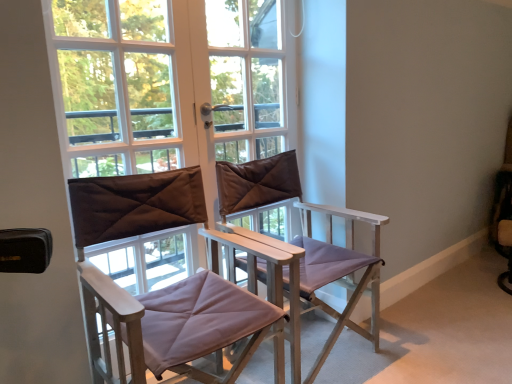
What is the approximate height of matte brown director's chair at center, the second chair in the right-to-left sequence?

34.02 inches.

The image size is (512, 384). I want to click on purple fabric chair at center, acting as the 1th chair starting from the right, so click(x=305, y=237).

Locate an element on the screen. Image resolution: width=512 pixels, height=384 pixels. matte brown director's chair at center, the second chair in the right-to-left sequence is located at coordinates (123, 289).

Considering the relative sizes of matte brown director's chair at center, arranged as the 1th chair when viewed from the left, and transparent glass window at center in the image provided, is matte brown director's chair at center, arranged as the 1th chair when viewed from the left, bigger than transparent glass window at center?

Correct, matte brown director's chair at center, arranged as the 1th chair when viewed from the left, is larger in size than transparent glass window at center.

From the image's perspective, which is below, matte brown director's chair at center, arranged as the 1th chair when viewed from the left, or transparent glass window at center?

matte brown director's chair at center, arranged as the 1th chair when viewed from the left.

Does point (286, 180) appear closer or farther from the camera than point (54, 85)?

Point (286, 180) is farther from the camera than point (54, 85).

You are a GUI agent. You are given a task and a screenshot of the screen. Output one action in this format:
    pyautogui.click(x=<x>, y=<y>)
    Task: Click on the window lying on the left of purple fabric chair at center, acting as the 1th chair starting from the right
    The image size is (512, 384).
    Given the screenshot: What is the action you would take?
    pyautogui.click(x=153, y=89)

Is purple fabric chair at center, which is the 2th chair in left-to-right order, facing towards transparent glass window at center?

No, purple fabric chair at center, which is the 2th chair in left-to-right order, is not oriented towards transparent glass window at center.

From the image's perspective, is purple fabric chair at center, which is the 2th chair in left-to-right order, on transparent glass window at center?

No, from the image's perspective, purple fabric chair at center, which is the 2th chair in left-to-right order, is not over transparent glass window at center.

Which is nearer, (162, 342) or (372, 270)?

Point (162, 342) is closer to the camera than point (372, 270).

Image resolution: width=512 pixels, height=384 pixels. Identify the location of chair on the right of matte brown director's chair at center, the second chair in the right-to-left sequence. (305, 237).

Considering the sizes of matte brown director's chair at center, the second chair in the right-to-left sequence, and purple fabric chair at center, which is the 2th chair in left-to-right order, in the image, is matte brown director's chair at center, the second chair in the right-to-left sequence, bigger or smaller than purple fabric chair at center, which is the 2th chair in left-to-right order,?

Considering their sizes, matte brown director's chair at center, the second chair in the right-to-left sequence, takes up less space than purple fabric chair at center, which is the 2th chair in left-to-right order.

From the image's perspective, between purple fabric chair at center, acting as the 1th chair starting from the right, and matte brown director's chair at center, arranged as the 1th chair when viewed from the left, who is located below?

From the image's view, matte brown director's chair at center, arranged as the 1th chair when viewed from the left, is below.

Could matte brown director's chair at center, arranged as the 1th chair when viewed from the left, be considered to be inside purple fabric chair at center, acting as the 1th chair starting from the right?

No, matte brown director's chair at center, arranged as the 1th chair when viewed from the left, is not a part of purple fabric chair at center, acting as the 1th chair starting from the right.

In the scene shown: Is purple fabric chair at center, which is the 2th chair in left-to-right order, touching matte brown director's chair at center, the second chair in the right-to-left sequence?

They are not placed beside each other.

Considering the relative positions of purple fabric chair at center, acting as the 1th chair starting from the right, and matte brown director's chair at center, arranged as the 1th chair when viewed from the left, in the image provided, is purple fabric chair at center, acting as the 1th chair starting from the right, in front of matte brown director's chair at center, arranged as the 1th chair when viewed from the left,?

No, the depth of purple fabric chair at center, acting as the 1th chair starting from the right, is greater than that of matte brown director's chair at center, arranged as the 1th chair when viewed from the left.

Based on the photo, does transparent glass window at center turn towards purple fabric chair at center, which is the 2th chair in left-to-right order?

Yes, transparent glass window at center is facing purple fabric chair at center, which is the 2th chair in left-to-right order.

Is transparent glass window at center in front of purple fabric chair at center, acting as the 1th chair starting from the right?

No, the depth of transparent glass window at center is greater than that of purple fabric chair at center, acting as the 1th chair starting from the right.

From a real-world perspective, is transparent glass window at center on purple fabric chair at center, which is the 2th chair in left-to-right order?

Yes, from a real-world perspective, transparent glass window at center is over purple fabric chair at center, which is the 2th chair in left-to-right order

The width and height of the screenshot is (512, 384). I want to click on window that is above the purple fabric chair at center, acting as the 1th chair starting from the right (from a real-world perspective), so click(x=153, y=89).

How much distance is there between transparent glass window at center and matte brown director's chair at center, arranged as the 1th chair when viewed from the left?

transparent glass window at center and matte brown director's chair at center, arranged as the 1th chair when viewed from the left, are 12.47 inches apart from each other.

From the picture: Is transparent glass window at center to the left of matte brown director's chair at center, arranged as the 1th chair when viewed from the left, from the viewer's perspective?

In fact, transparent glass window at center is to the right of matte brown director's chair at center, arranged as the 1th chair when viewed from the left.

Does transparent glass window at center have a greater width compared to matte brown director's chair at center, the second chair in the right-to-left sequence?

Incorrect, the width of transparent glass window at center does not surpass that of matte brown director's chair at center, the second chair in the right-to-left sequence.

Find the location of a particular element. the 1st chair positioned below the transparent glass window at center (from a real-world perspective) is located at coordinates (123, 289).

The image size is (512, 384). In the image, there is a purple fabric chair at center, acting as the 1th chair starting from the right. Identify the location of window above it (from the image's perspective). (153, 89).

When comparing their distances from purple fabric chair at center, which is the 2th chair in left-to-right order, does transparent glass window at center or matte brown director's chair at center, the second chair in the right-to-left sequence, seem further?

Among the two, transparent glass window at center is located further to purple fabric chair at center, which is the 2th chair in left-to-right order.

Based on their spatial positions, is purple fabric chair at center, which is the 2th chair in left-to-right order, or matte brown director's chair at center, the second chair in the right-to-left sequence, closer to transparent glass window at center?

Based on the image, matte brown director's chair at center, the second chair in the right-to-left sequence, appears to be nearer to transparent glass window at center.

Estimate the real-world distances between objects in this image. Which object is closer to transparent glass window at center, matte brown director's chair at center, the second chair in the right-to-left sequence, or purple fabric chair at center, acting as the 1th chair starting from the right?

matte brown director's chair at center, the second chair in the right-to-left sequence, lies closer to transparent glass window at center than the other object.

Looking at the image, which one is located closer to matte brown director's chair at center, the second chair in the right-to-left sequence, purple fabric chair at center, acting as the 1th chair starting from the right, or transparent glass window at center?

transparent glass window at center lies closer to matte brown director's chair at center, the second chair in the right-to-left sequence, than the other object.

When comparing their distances from purple fabric chair at center, acting as the 1th chair starting from the right, does matte brown director's chair at center, the second chair in the right-to-left sequence, or transparent glass window at center seem closer?

matte brown director's chair at center, the second chair in the right-to-left sequence, lies closer to purple fabric chair at center, acting as the 1th chair starting from the right, than the other object.

Estimate the real-world distances between objects in this image. Which object is further from matte brown director's chair at center, the second chair in the right-to-left sequence, transparent glass window at center or purple fabric chair at center, acting as the 1th chair starting from the right?

The object further to matte brown director's chair at center, the second chair in the right-to-left sequence, is purple fabric chair at center, acting as the 1th chair starting from the right.

You are a GUI agent. You are given a task and a screenshot of the screen. Output one action in this format:
    pyautogui.click(x=<x>, y=<y>)
    Task: Click on the window between matte brown director's chair at center, the second chair in the right-to-left sequence, and purple fabric chair at center, which is the 2th chair in left-to-right order, in the horizontal direction
    This screenshot has width=512, height=384.
    Given the screenshot: What is the action you would take?
    pyautogui.click(x=153, y=89)